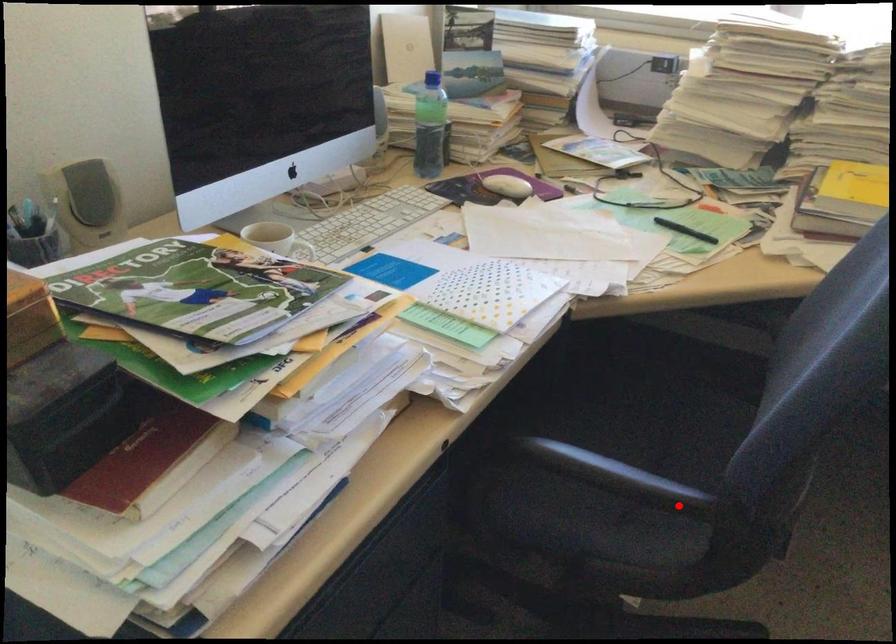
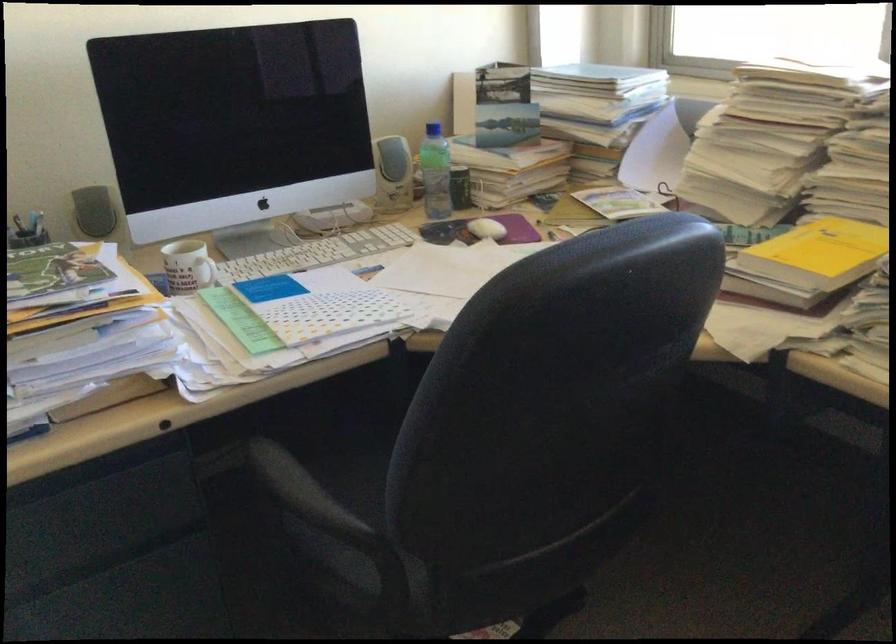
Locate, in the second image, the point that corresponds to the highlighted location in the first image.

(314, 521)